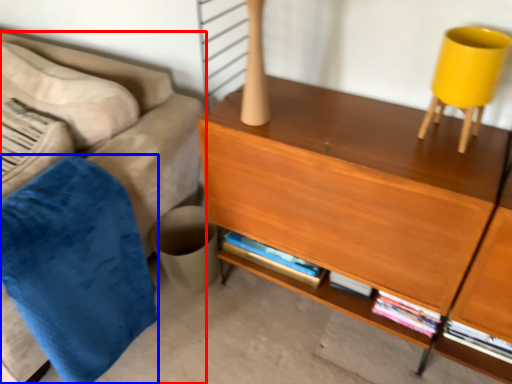
Question: Which point is further to the camera, studio couch (highlighted by a red box) or blanket (highlighted by a blue box)?

Choices:
 (A) studio couch
 (B) blanket

Answer: (B)